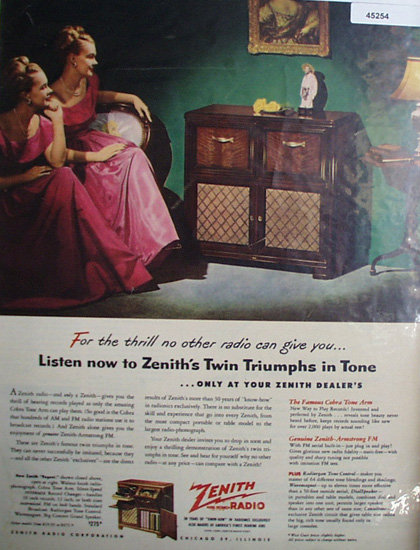
Locate an element on the screen. radio speakers is located at coordinates (295, 209), (225, 196).